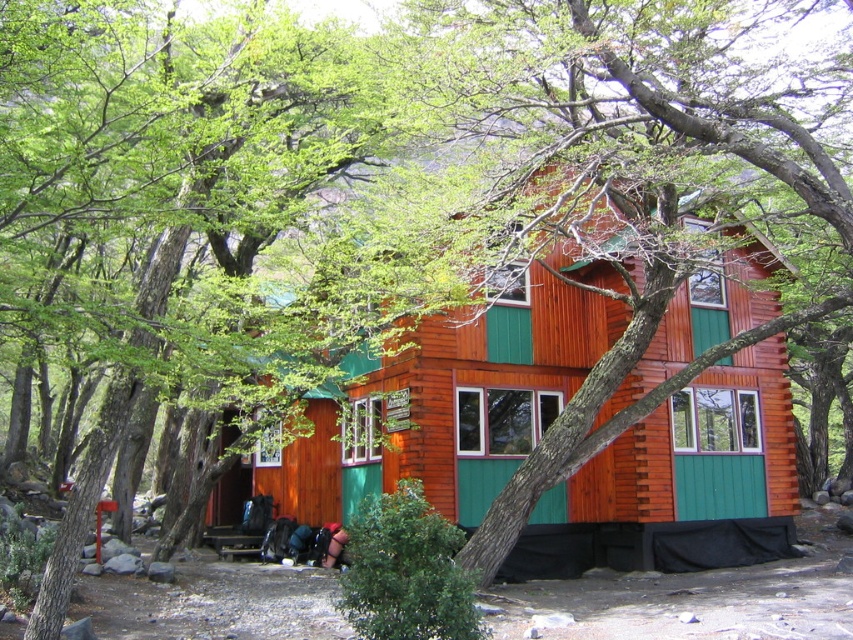
You are planning to build a small garden between the wooden cabin at center and the green wood tree at center. Based on their sizes, which one should you place the garden closer to?

The wooden cabin at center has a smaller size compared to the green wood tree at center, so the garden should be placed closer to the wooden cabin at center to ensure there is enough space around the larger tree.

You are planning to build a small garden between the wooden cabin at center and the green wood tree at center. The garden requires a minimum of 10 feet of space. Based on the scene description, is there enough space for the garden?

The distance between the wooden cabin at center and the green wood tree at center is 15.52 feet, which is more than the required 10 feet, so there is sufficient space for the garden.